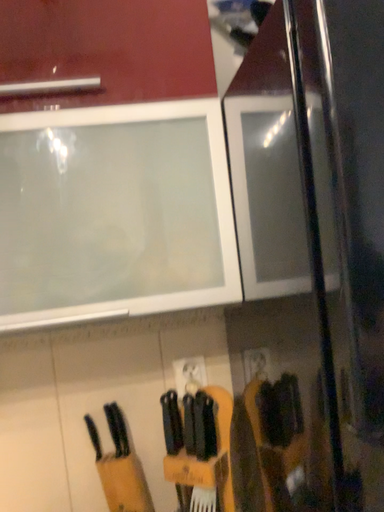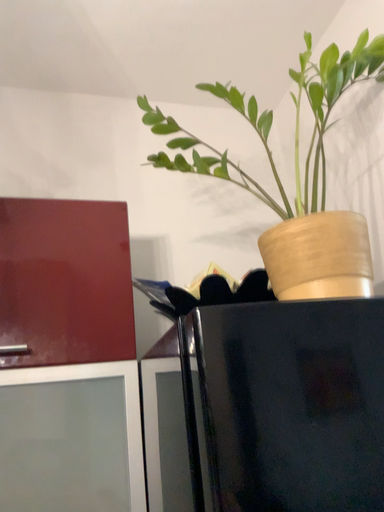
Question: How did the camera likely rotate when shooting the video?

Choices:
 (A) rotated upward
 (B) rotated downward

Answer: (A)